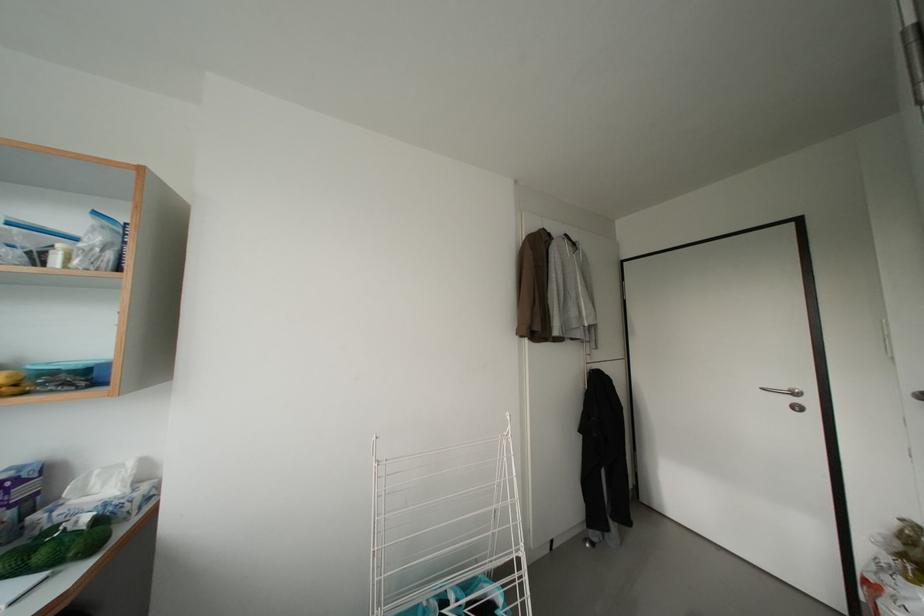
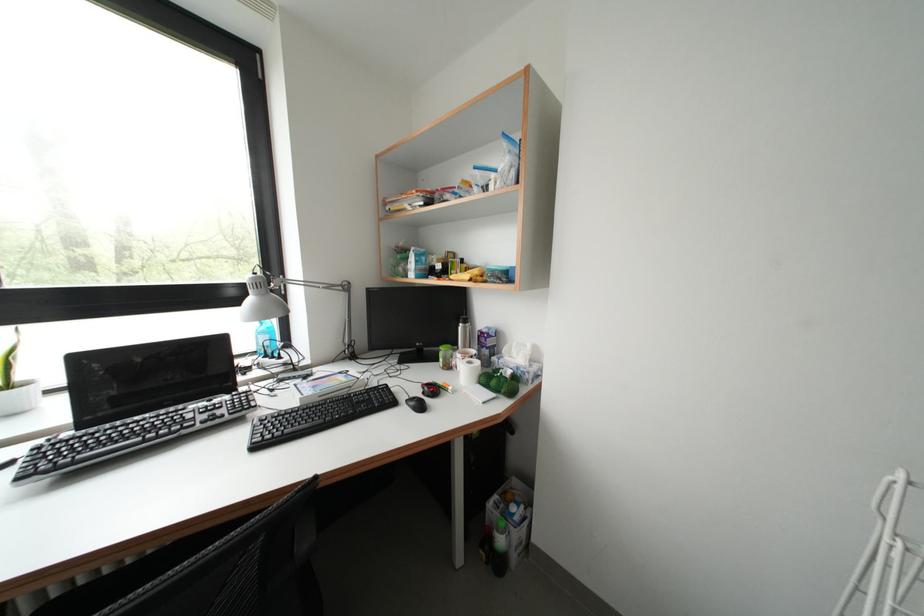
Question: The camera is either moving clockwise (left) or counter-clockwise (right) around the object. The first image is from the beginning of the video and the second image is from the end. Is the camera moving left or right when shooting the video?

Choices:
 (A) Left
 (B) Right

Answer: (B)